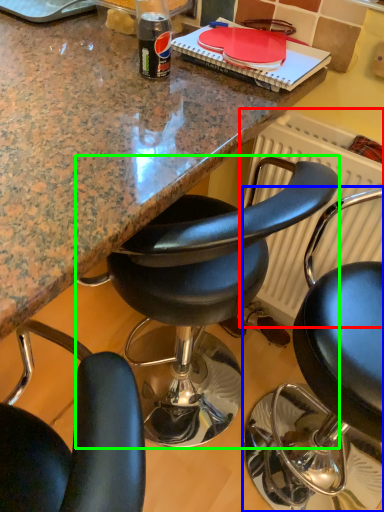
Question: Considering the real-world distances, which object is closest to radiator (highlighted by a red box)? chair (highlighted by a blue box) or chair (highlighted by a green box).

Choices:
 (A) chair
 (B) chair

Answer: (B)